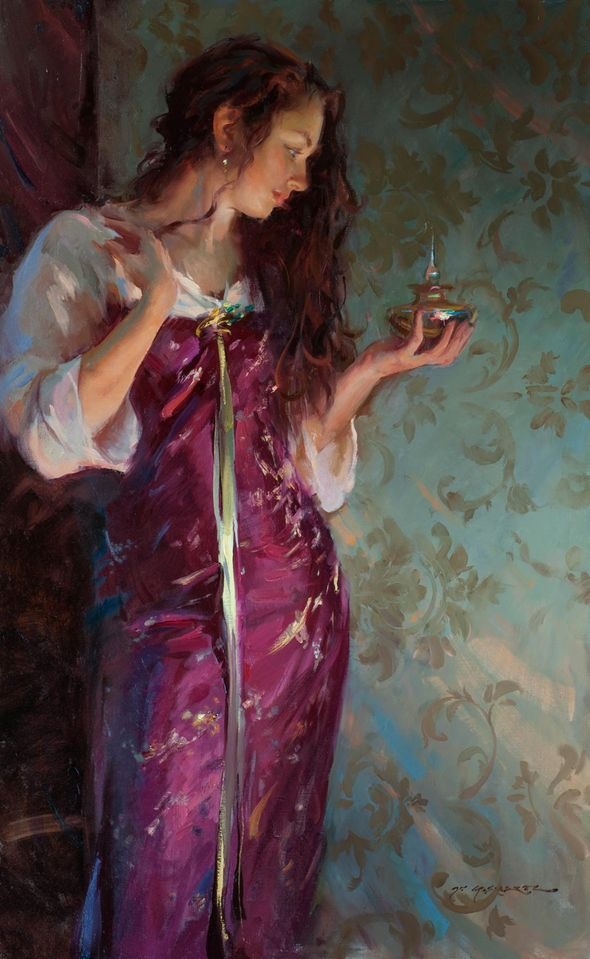
This screenshot has width=590, height=959. I want to click on glass jar, so coord(439,305).